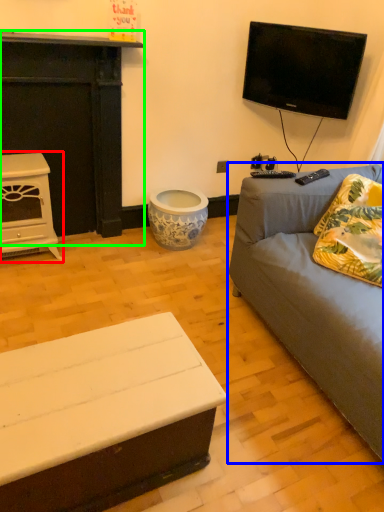
Question: Estimate the real-world distances between objects in this image. Which object is closer to fireplace (highlighted by a red box), studio couch (highlighted by a blue box) or fireplace (highlighted by a green box)?

Choices:
 (A) studio couch
 (B) fireplace

Answer: (B)